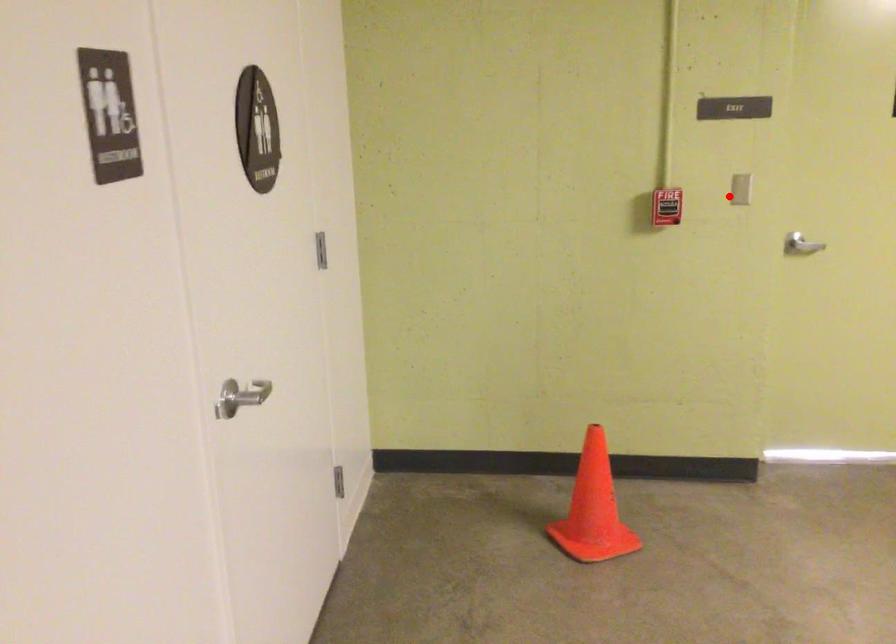
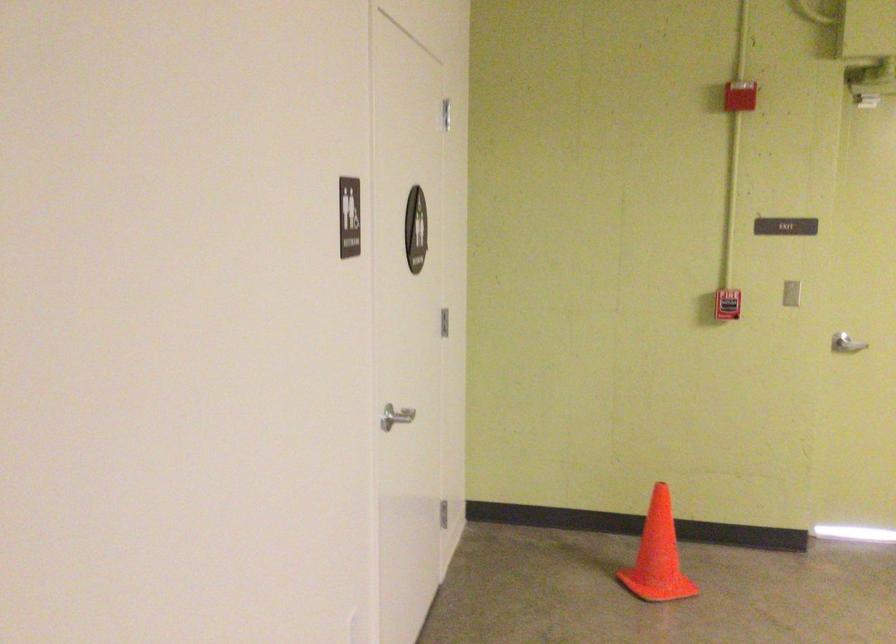
The point at the highlighted location is marked in the first image. Where is the corresponding point in the second image?

(790, 292)